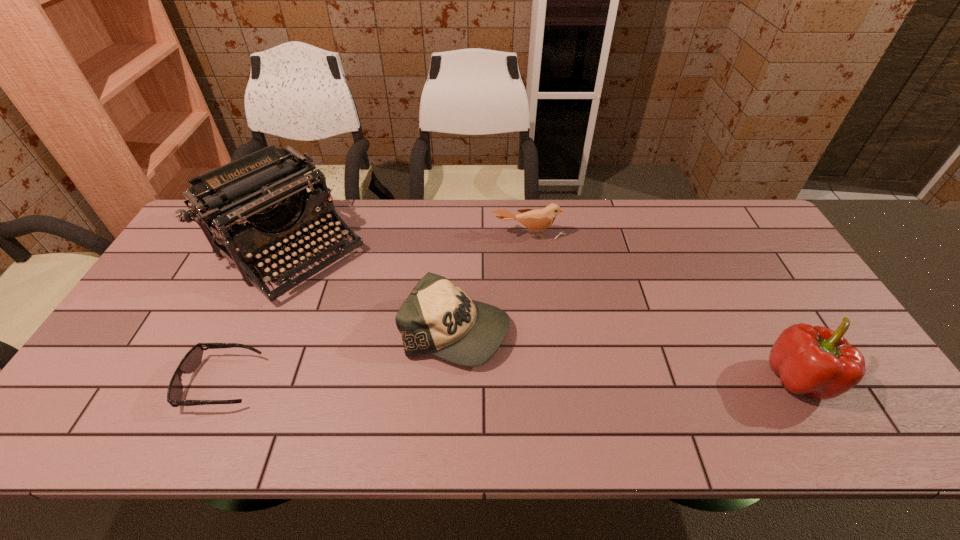
Identify which object is the closest to the bird. Please provide its 2D coordinates. Your answer should be formatted as a tuple, i.e. [(x, y)], where the tuple contains the x and y coordinates of a point satisfying the conditions above.

[(439, 318)]

Choose which object is the fourth nearest neighbor to the baseball cap. Please provide its 2D coordinates. Your answer should be formatted as a tuple, i.e. [(x, y)], where the tuple contains the x and y coordinates of a point satisfying the conditions above.

[(817, 361)]

You are a GUI agent. You are given a task and a screenshot of the screen. Output one action in this format:
    pyautogui.click(x=<x>, y=<y>)
    Task: Click on the free point that satisfies the following two spatial constraints: 1. on the back side of the baseball cap; 2. on the left side of the bird
    Image resolution: width=960 pixels, height=540 pixels.
    Given the screenshot: What is the action you would take?
    pyautogui.click(x=461, y=235)

Locate an element on the screen. This screenshot has width=960, height=540. vacant position in the image that satisfies the following two spatial constraints: 1. on the front side of the pepper; 2. on the left side of the baseball cap is located at coordinates (454, 379).

The height and width of the screenshot is (540, 960). Identify the location of vacant space that satisfies the following two spatial constraints: 1. on the back side of the bird; 2. on the right side of the typewriter. (295, 235).